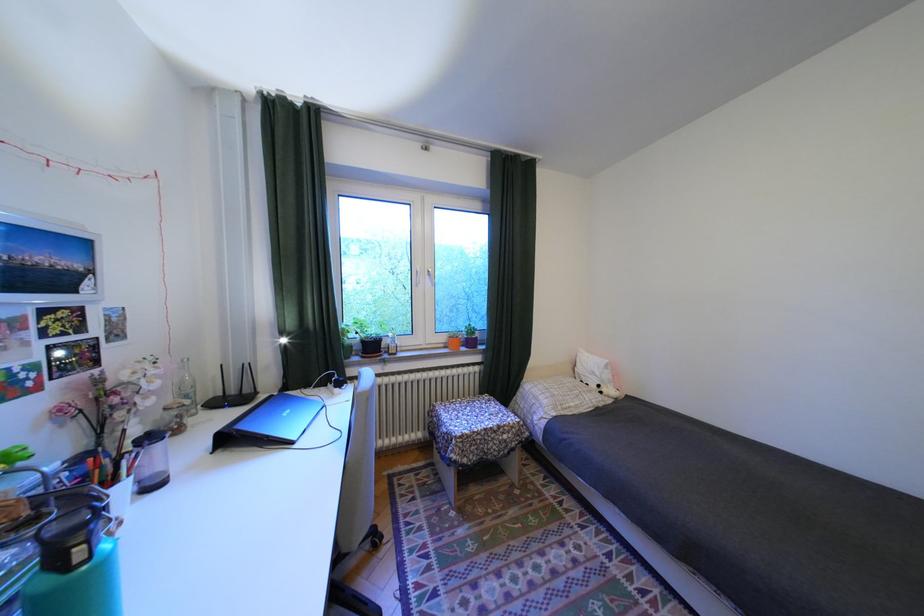
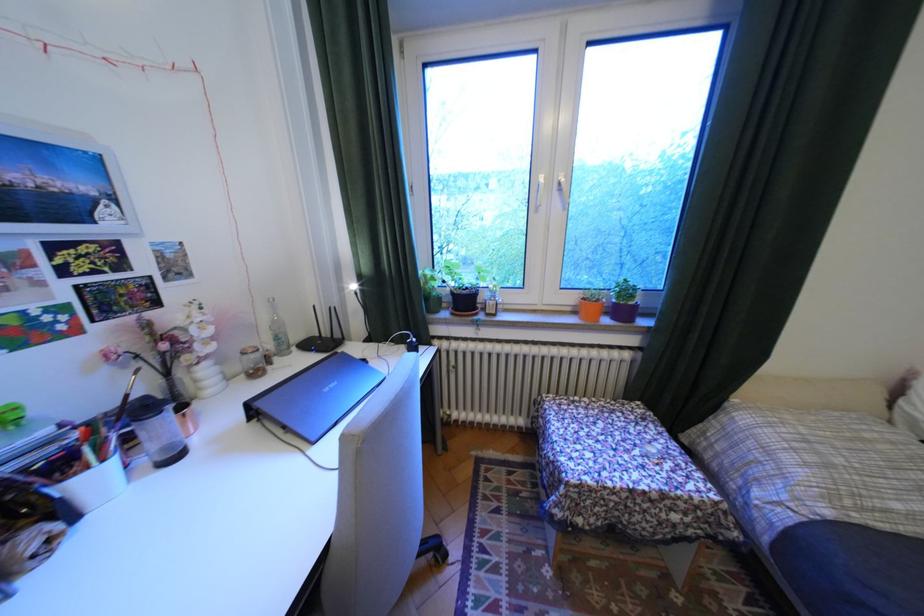
Locate, in the second image, the point that corresponds to (x=178, y=410) in the first image.

(254, 354)